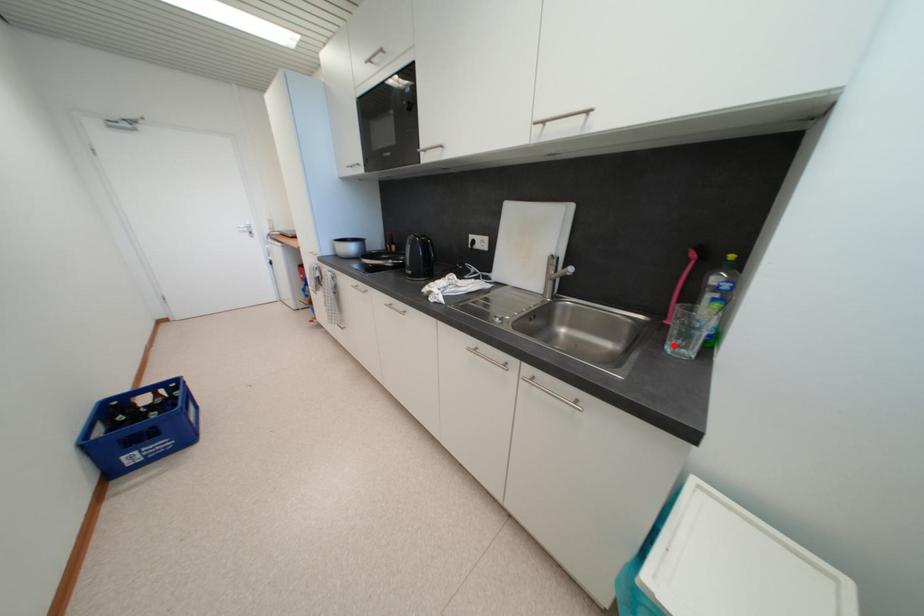
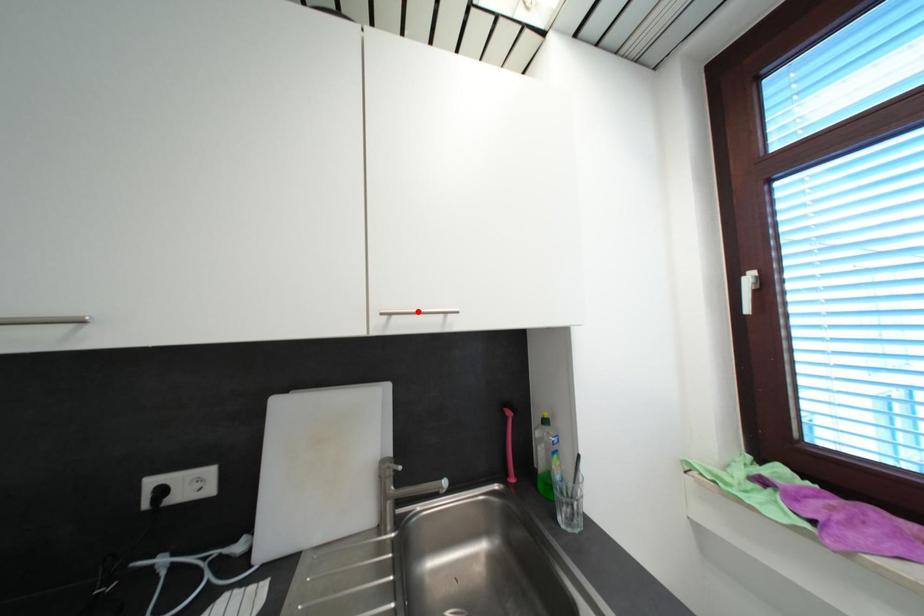
I am providing you with two images of the same scene from different viewpoints. A red point is marked on the first image and another point is marked on the second image. Is the red point in image1 aligned with the point shown in image2?

No